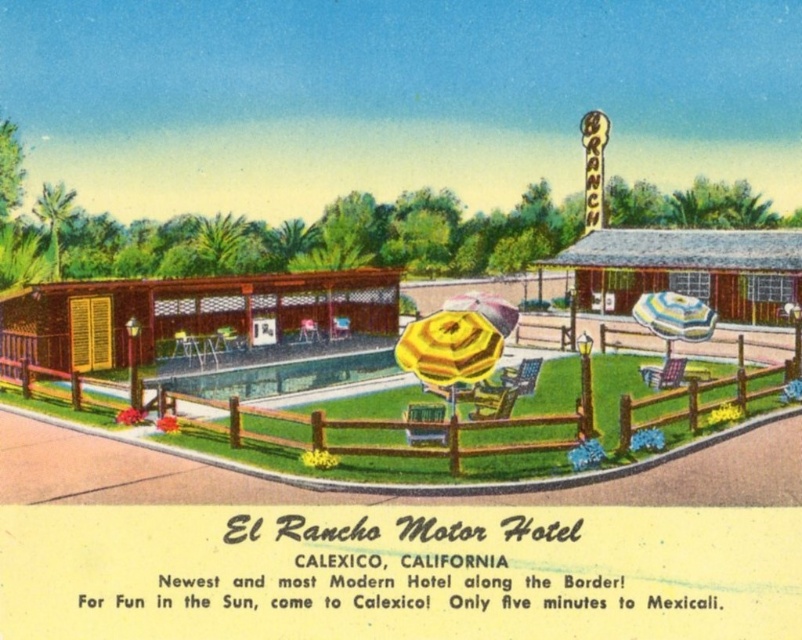
Question: Can you confirm if brown wooden fence at lower left is thinner than striped fabric umbrella at center?

Choices:
 (A) no
 (B) yes

Answer: (A)

Question: Among these objects, which one is nearest to the camera?

Choices:
 (A) yellow striped umbrella at center
 (B) yellow fabric umbrella at center

Answer: (A)

Question: Which point appears farthest from the camera in this image?

Choices:
 (A) (703, 317)
 (B) (493, 365)
 (C) (330, 419)
 (D) (474, 301)

Answer: (D)

Question: Considering the relative positions of brown wooden fence at lower left and yellow fabric umbrella at center in the image provided, where is brown wooden fence at lower left located with respect to yellow fabric umbrella at center?

Choices:
 (A) below
 (B) above

Answer: (A)

Question: Which point appears closest to the camera in this image?

Choices:
 (A) (687, 308)
 (B) (323, 429)
 (C) (485, 362)

Answer: (B)

Question: Considering the relative positions of brown wooden fence at lower left and yellow striped umbrella at center in the image provided, where is brown wooden fence at lower left located with respect to yellow striped umbrella at center?

Choices:
 (A) right
 (B) left

Answer: (A)